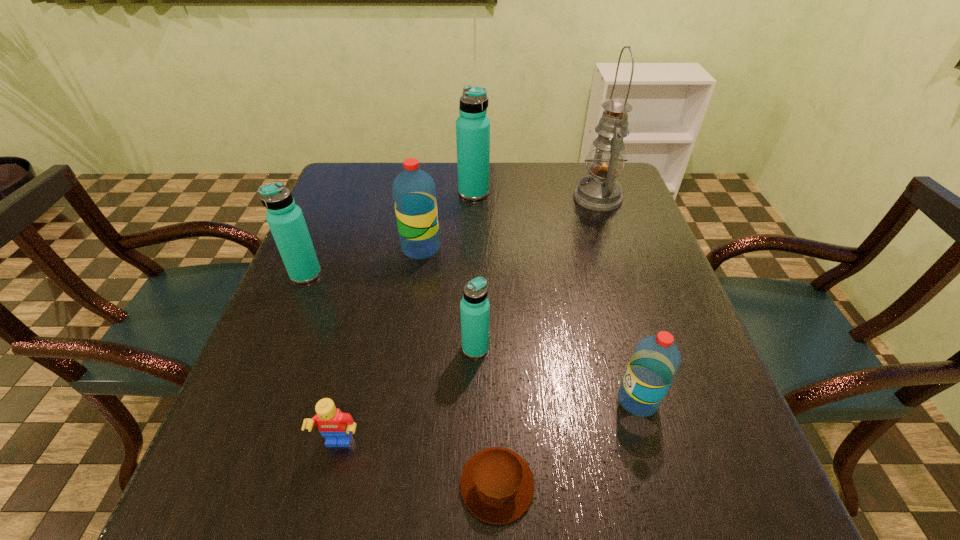
Identify the location of water bottle that is at the right edge. pyautogui.click(x=655, y=361).

Identify the location of object present at the far right corner. This screenshot has height=540, width=960. (599, 191).

This screenshot has width=960, height=540. In order to click on vacant area at the far edge in this screenshot , I will do `click(548, 198)`.

At what (x,y) coordinates should I click in order to perform the action: click on free space at the left edge of the desktop. Please return your answer as a coordinate pair (x, y). Looking at the image, I should click on (342, 268).

The width and height of the screenshot is (960, 540). Identify the location of vacant space at the right edge. (x=624, y=358).

Where is `free region at the far left corner of the desktop`? This screenshot has width=960, height=540. free region at the far left corner of the desktop is located at coordinates (350, 203).

Find the location of a particular element. unoccupied position between the bigger red water bottle and the muffin is located at coordinates point(459,367).

Find the location of a particular element. Image resolution: width=960 pixels, height=540 pixels. blank region between the farther red water bottle and the oil lamp is located at coordinates (510, 223).

Image resolution: width=960 pixels, height=540 pixels. What are the coordinates of `free space between the third farthest object and the oil lamp` in the screenshot? It's located at (510, 223).

Where is `vacant space in between the second tallest object and the second smallest blue water bottle`? This screenshot has height=540, width=960. vacant space in between the second tallest object and the second smallest blue water bottle is located at coordinates (390, 233).